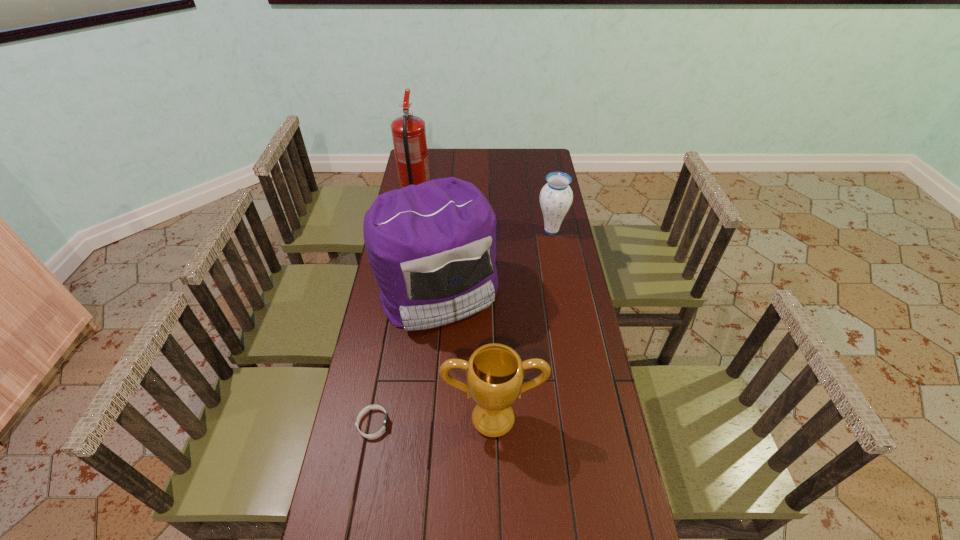
The height and width of the screenshot is (540, 960). Identify the location of free space at the left edge of the desktop. (381, 478).

Locate an element on the screen. vacant point at the right edge is located at coordinates (532, 207).

Identify the location of free area in between the award and the third farthest object. (466, 355).

This screenshot has width=960, height=540. What are the coordinates of `free space between the award and the shortest object` in the screenshot? It's located at (433, 421).

Identify the location of free space between the vase and the award. The image size is (960, 540). (522, 325).

Where is `unoccupied position between the backpack and the shortest object`? Image resolution: width=960 pixels, height=540 pixels. unoccupied position between the backpack and the shortest object is located at coordinates (406, 358).

Identify which object is located as the nearest to the vase. Please provide its 2D coordinates. Your answer should be formatted as a tuple, i.e. [(x, y)], where the tuple contains the x and y coordinates of a point satisfying the conditions above.

[(432, 247)]

Identify which object is the second closest to the wristband. Please provide its 2D coordinates. Your answer should be formatted as a tuple, i.e. [(x, y)], where the tuple contains the x and y coordinates of a point satisfying the conditions above.

[(432, 247)]